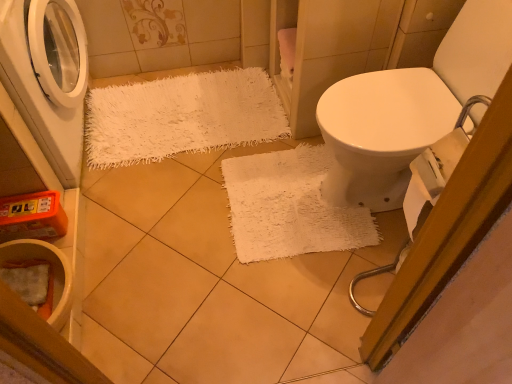
The height and width of the screenshot is (384, 512). I want to click on free space in front of white shaggy rug at upper left, so click(196, 228).